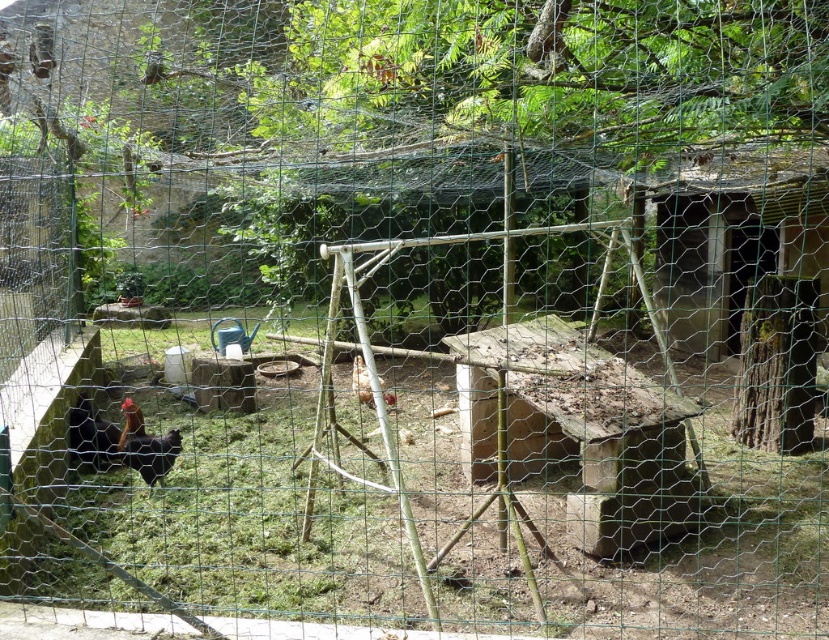
Question: Does black matte chicken at lower left have a lesser width compared to brown matte chicken at center?

Choices:
 (A) yes
 (B) no

Answer: (A)

Question: Which of the following is the closest to the observer?

Choices:
 (A) black matte chicken at lower left
 (B) brown matte chicken at center

Answer: (A)

Question: Is black matte chicken at lower left thinner than brown matte chicken at center?

Choices:
 (A) no
 (B) yes

Answer: (B)

Question: Is black matte chicken at lower left positioned before brown matte chicken at center?

Choices:
 (A) yes
 (B) no

Answer: (A)

Question: Which object appears farthest from the camera in this image?

Choices:
 (A) black matte chicken at lower left
 (B) brown matte chicken at center

Answer: (B)